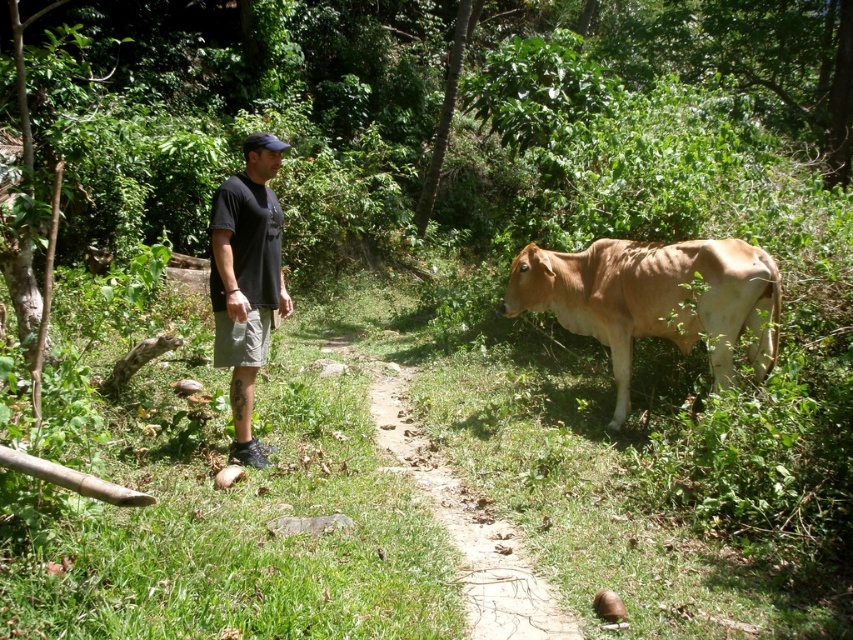
Measure the distance from green grassy trail at center to black cotton t-shirt at center.

green grassy trail at center is 4.11 feet from black cotton t-shirt at center.

Between green grassy trail at center and black cotton t-shirt at center, which one has more height?

With more height is black cotton t-shirt at center.

Who is more distant from viewer, (518, 600) or (241, 330)?

Positioned behind is point (241, 330).

Locate an element on the screen. The width and height of the screenshot is (853, 640). green grassy trail at center is located at coordinates (462, 522).

Consider the image. Is brown smooth cow at right above green grassy trail at center?

Yes, brown smooth cow at right is above green grassy trail at center.

Which is more to the left, brown smooth cow at right or green grassy trail at center?

green grassy trail at center is more to the left.

I want to click on brown smooth cow at right, so click(654, 300).

The height and width of the screenshot is (640, 853). I want to click on brown smooth cow at right, so click(x=654, y=300).

Is the position of brown smooth cow at right less distant than that of black cotton t-shirt at center?

No, it is not.

Which is below, brown smooth cow at right or black cotton t-shirt at center?

brown smooth cow at right

Looking at this image, who is more distant from viewer, (762,268) or (231,192)?

Point (762,268)

This screenshot has height=640, width=853. What are the coordinates of `brown smooth cow at right` in the screenshot? It's located at (654, 300).